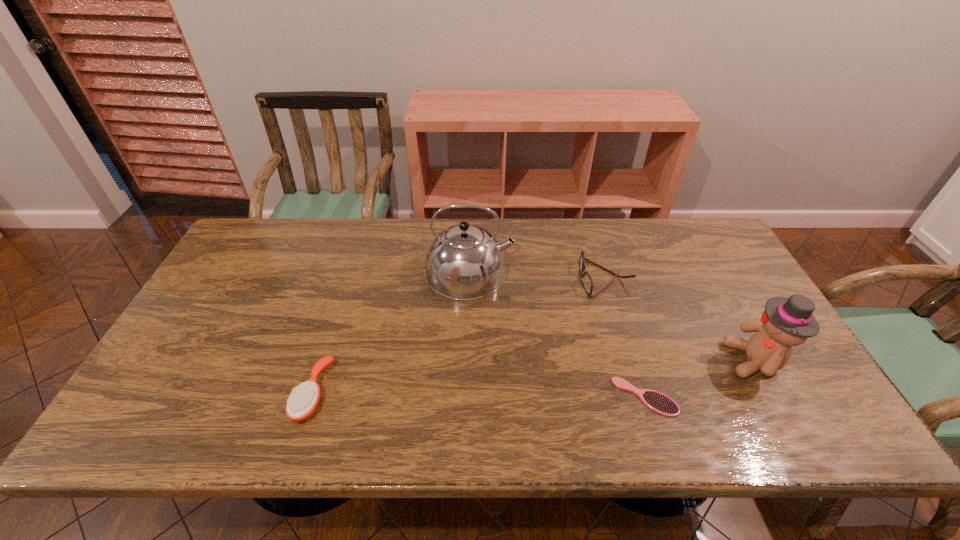
Image resolution: width=960 pixels, height=540 pixels. Find the location of `free space that satisfies the following two spatial constraints: 1. on the front-facing side of the fourth shortest object; 2. on the front side of the shortest object`. free space that satisfies the following two spatial constraints: 1. on the front-facing side of the fourth shortest object; 2. on the front side of the shortest object is located at coordinates (776, 397).